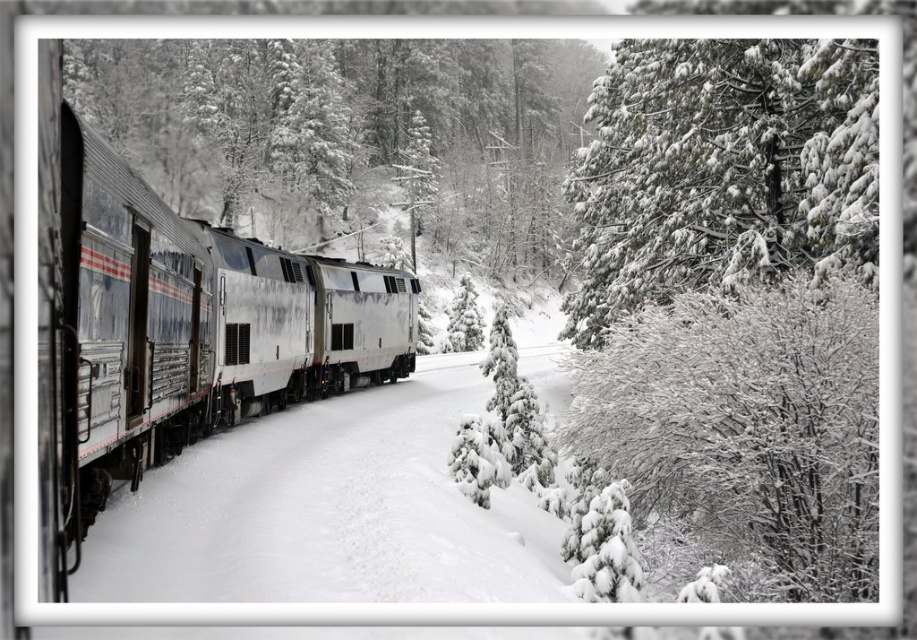
Is white fluffy snow at center wider than silver metallic locomotive at center?

Indeed, white fluffy snow at center has a greater width compared to silver metallic locomotive at center.

Who is lower down, white fluffy snow at center or silver metallic locomotive at center?

white fluffy snow at center is lower down.

Where is `white fluffy snow at center`? The image size is (917, 640). white fluffy snow at center is located at coordinates (327, 512).

You are a GUI agent. You are given a task and a screenshot of the screen. Output one action in this format:
    pyautogui.click(x=<x>, y=<y>)
    Task: Click on the white fluffy snow at center
    
    Given the screenshot: What is the action you would take?
    pyautogui.click(x=327, y=512)

Does point (216, 74) lie in front of point (343, 548)?

No, (216, 74) is further to viewer.

Between point (365, 176) and point (192, 464), which one is positioned behind?

The point (365, 176) is behind.

Who is more forward, (163, 83) or (420, 452)?

Point (420, 452) is in front.

The height and width of the screenshot is (640, 917). I want to click on snow-covered pine tree at left, so click(350, 129).

How far apart are silver metallic train at left and snow-covered evergreen at upper right?

silver metallic train at left is 9.69 meters away from snow-covered evergreen at upper right.

Between silver metallic train at left and snow-covered evergreen at upper right, which one is positioned lower?

silver metallic train at left is lower down.

Which is behind, point (286, 324) or point (636, 291)?

The point (636, 291) is behind.

Locate an element on the screen. silver metallic train at left is located at coordinates (191, 326).